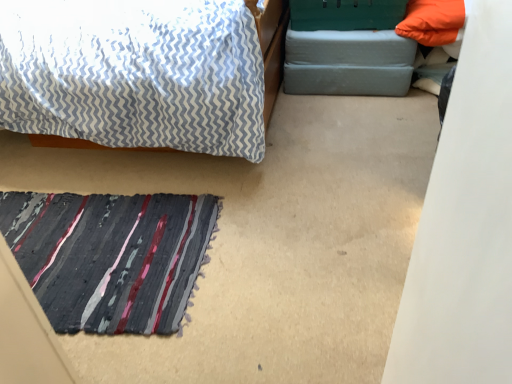
Question: Does point (55, 200) appear closer or farther from the camera than point (397, 81)?

Choices:
 (A) farther
 (B) closer

Answer: (B)

Question: From a real-world perspective, is textured striped mat at lower left positioned above or below gray fabric footrest at upper right?

Choices:
 (A) below
 (B) above

Answer: (A)

Question: Is textured striped mat at lower left taller or shorter than gray fabric footrest at upper right?

Choices:
 (A) short
 (B) tall

Answer: (A)

Question: Considering the positions of point (402, 71) and point (83, 233), is point (402, 71) closer or farther from the camera than point (83, 233)?

Choices:
 (A) farther
 (B) closer

Answer: (A)

Question: From their relative heights in the image, would you say gray fabric footrest at upper right is taller or shorter than textured striped mat at lower left?

Choices:
 (A) tall
 (B) short

Answer: (A)

Question: Choose the correct answer: Is gray fabric footrest at upper right inside textured striped mat at lower left or outside it?

Choices:
 (A) inside
 (B) outside

Answer: (B)

Question: From the image's perspective, is gray fabric footrest at upper right located above or below textured striped mat at lower left?

Choices:
 (A) above
 (B) below

Answer: (A)